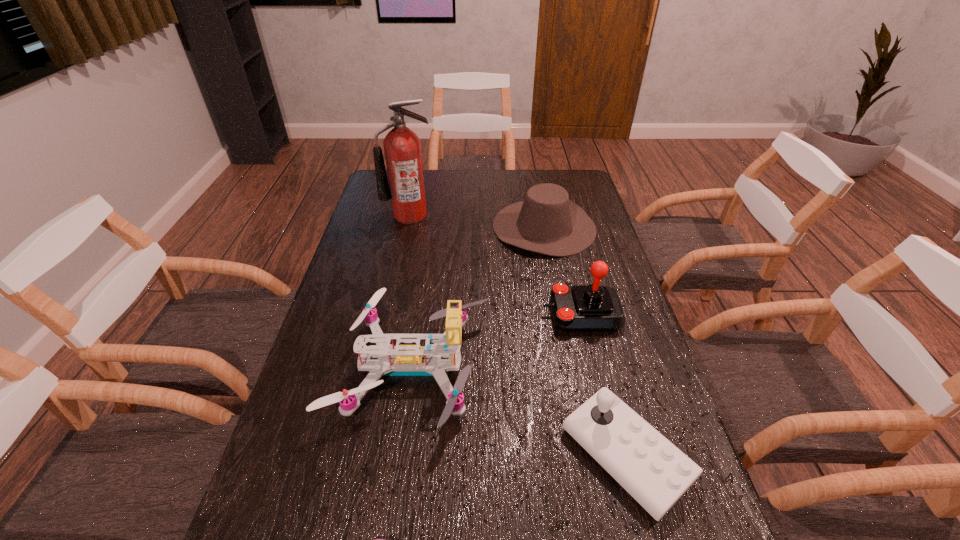
The width and height of the screenshot is (960, 540). Identify the location of fire extinguisher. (402, 147).

Locate an element on the screen. The image size is (960, 540). drone is located at coordinates (401, 360).

Where is `the farther joystick`? the farther joystick is located at coordinates (583, 308).

Find the location of a particular element. cowboy hat is located at coordinates (547, 222).

Where is `the shorter joystick`? The width and height of the screenshot is (960, 540). the shorter joystick is located at coordinates (647, 465).

Locate an element on the screen. vacant position located on the front of the fire extinguisher near the operation label is located at coordinates point(392,301).

This screenshot has height=540, width=960. Identify the location of vacant area situated on the front-facing side of the drone. (591, 368).

At what (x,y) coordinates should I click in order to perform the action: click on blank space located on the base of the taller joystick. Please return your answer as a coordinate pair (x, y). Looking at the image, I should click on (515, 314).

This screenshot has width=960, height=540. I want to click on free spot located on the base of the taller joystick, so click(518, 314).

Locate an element on the screen. Image resolution: width=960 pixels, height=540 pixels. free region located on the base of the taller joystick is located at coordinates (525, 314).